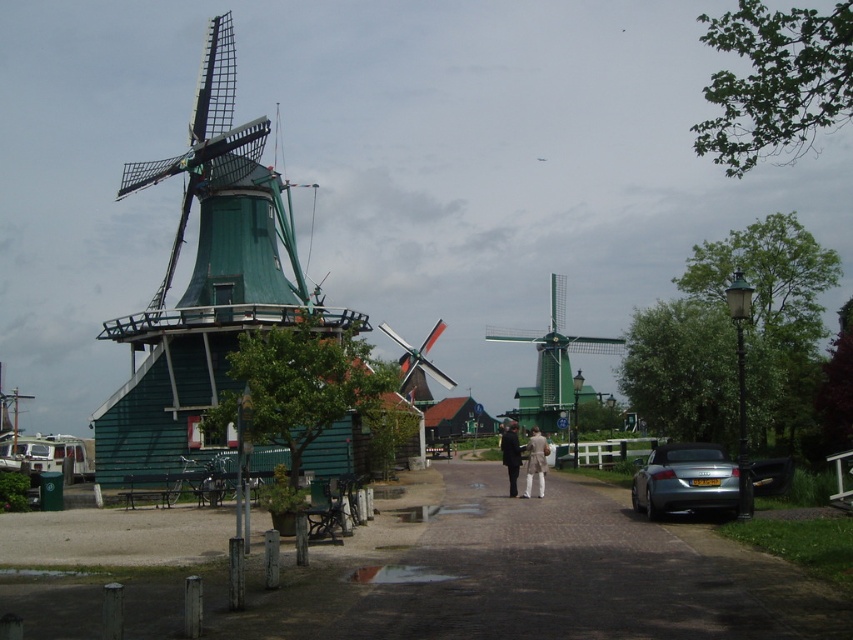
Question: Does dark brown cobblestone at center appear over silver metallic car at lower right?

Choices:
 (A) yes
 (B) no

Answer: (B)

Question: Among these points, which one is farthest from the camera?

Choices:
 (A) click(537, 458)
 (B) click(556, 381)
 (C) click(181, 161)
 (D) click(515, 448)

Answer: (B)

Question: Which object is the farthest from the green wooden windmill at center?

Choices:
 (A) green wooden windmill at left
 (B) dark brown leather jacket at center

Answer: (A)

Question: Can you confirm if dark brown cobblestone at center is smaller than dark brown leather jacket at center?

Choices:
 (A) yes
 (B) no

Answer: (A)

Question: Can you confirm if dark brown cobblestone at center is bigger than silver metallic car at lower right?

Choices:
 (A) yes
 (B) no

Answer: (A)

Question: Which of the following is the closest to the observer?

Choices:
 (A) (515, 452)
 (B) (216, 28)
 (C) (712, 595)

Answer: (C)